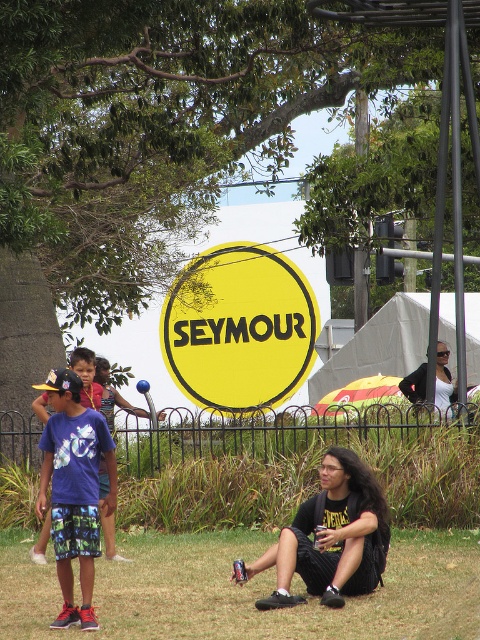
Question: Is black fabric backpack at lower center positioned before white matte shirt at upper right?

Choices:
 (A) no
 (B) yes

Answer: (B)

Question: Which of the following is the closest to the observer?

Choices:
 (A) black fabric backpack at lower center
 (B) blue printed t-shirt at left
 (C) green grass at lower center

Answer: (C)

Question: Can you confirm if green grass at lower center is smaller than blue printed t-shirt at left?

Choices:
 (A) no
 (B) yes

Answer: (B)

Question: Estimate the real-world distances between objects in this image. Which object is farther from the blue printed t-shirt at left?

Choices:
 (A) white matte shirt at upper right
 (B) yellow matte sign at center
 (C) black fabric backpack at lower center

Answer: (B)

Question: Can you confirm if black fabric backpack at lower center is positioned below white matte shirt at upper right?

Choices:
 (A) yes
 (B) no

Answer: (A)

Question: Estimate the real-world distances between objects in this image. Which object is farther from the yellow matte sign at center?

Choices:
 (A) green grass at lower center
 (B) white matte shirt at upper right
 (C) black fabric backpack at lower center

Answer: (C)